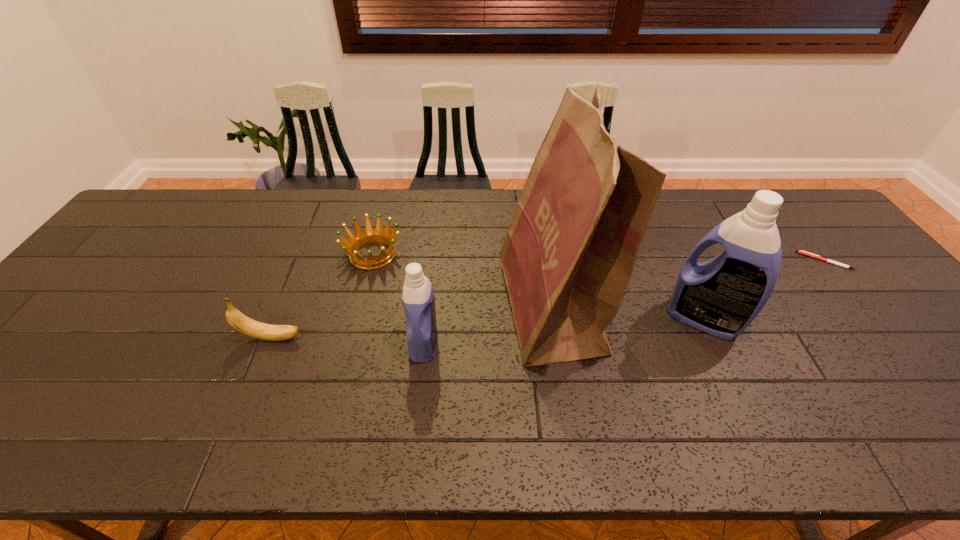
Please point a spot on the left to add another detergent. Please provide its 2D coordinates. Your answer should be formatted as a tuple, i.e. [(x, y)], where the tuple contains the x and y coordinates of a point satisfying the conditions above.

[(115, 368)]